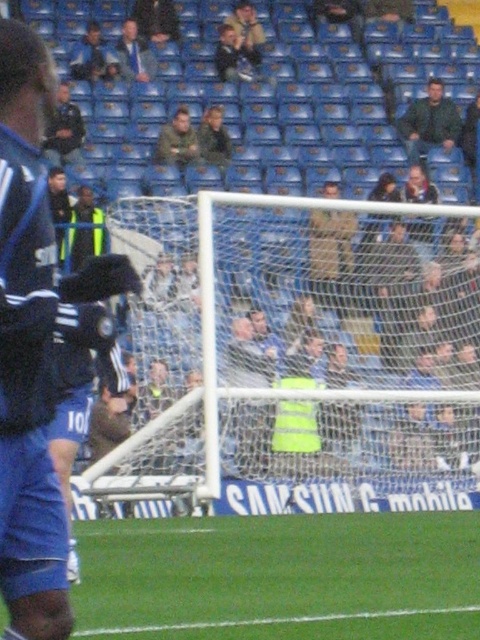
You are a photographer who just took a photo of a soccer match. You want to know if the point at coordinate (35, 296) is closer to the camera than the point at (168, 3). Based on the scene description, can you confirm this?

Yes, according to the description, point (35, 296) is closer to the camera than point (168, 3).

You are a soccer player trying to score a goal. The soccer goal has a white mesh net at center. Where should you aim your shot to ensure it goes into the net?

You should aim your shot towards the white mesh net at center located at the coordinates point (304, 355).